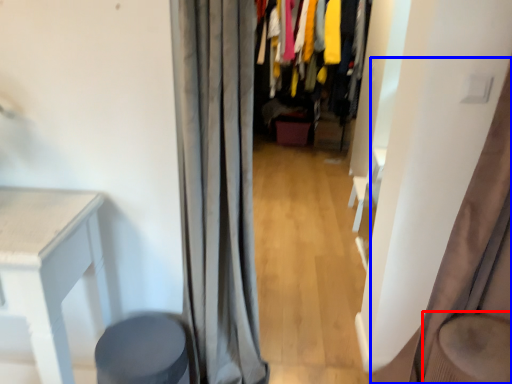
Question: Which object is further to the camera taking this photo, swivel chair (highlighted by a red box) or curtain (highlighted by a blue box)?

Choices:
 (A) swivel chair
 (B) curtain

Answer: (A)